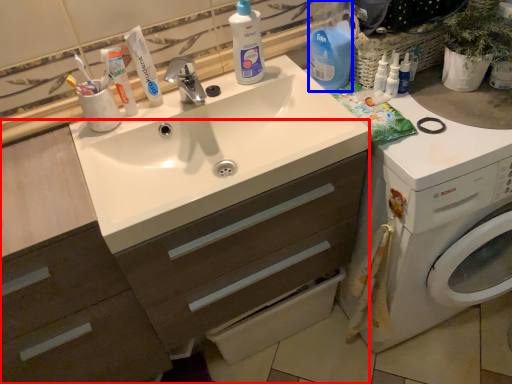
Question: Among these objects, which one is farthest to the camera, dresser (highlighted by a red box) or cleaning product (highlighted by a blue box)?

Choices:
 (A) dresser
 (B) cleaning product

Answer: (B)